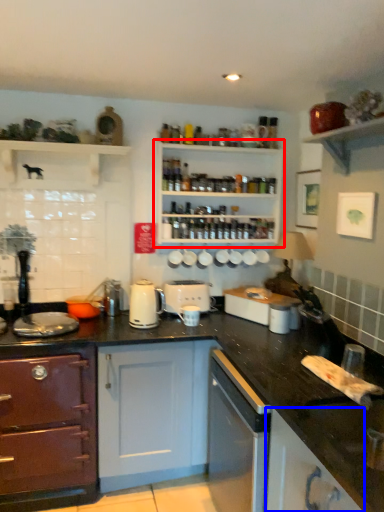
Question: Which of the following is the closest to the observer, shelf (highlighted by a red box) or cabinetry (highlighted by a blue box)?

Choices:
 (A) shelf
 (B) cabinetry

Answer: (B)